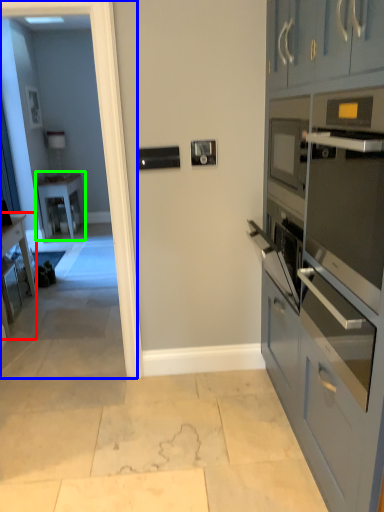
Question: Which is nearer to the desk (highlighted by a red box)? glass door (highlighted by a blue box) or table (highlighted by a green box).

Choices:
 (A) glass door
 (B) table

Answer: (A)